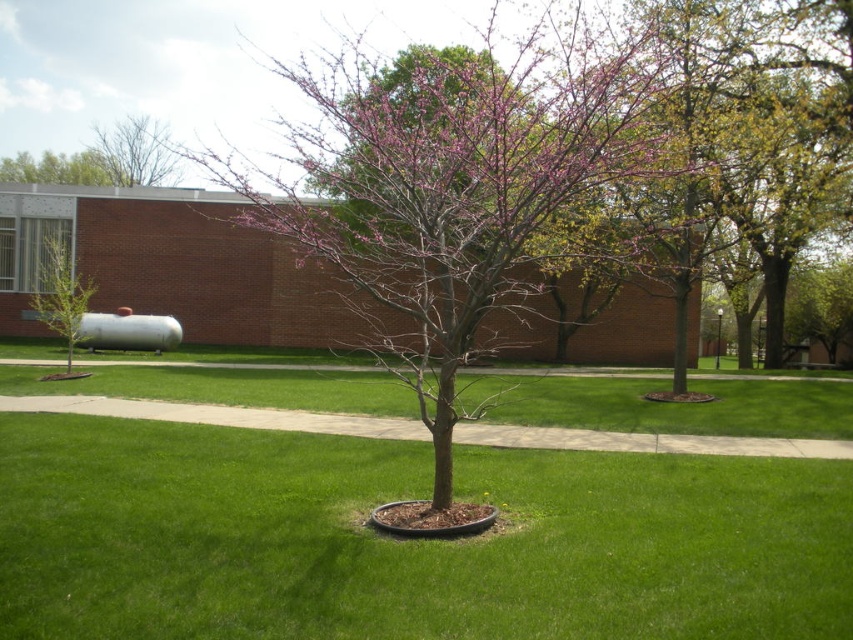
Which is behind, point (421, 381) or point (161, 124)?

The point (161, 124) is behind.

Between point (646, 42) and point (154, 163), which one is positioned behind?

Positioned behind is point (154, 163).

Locate an element on the screen. This screenshot has height=640, width=853. purple-barked tree at center is located at coordinates tap(459, 180).

Which is more to the left, bare branches at upper left or green leafy tree at left?

bare branches at upper left

Which is behind, point (152, 172) or point (45, 269)?

The point (152, 172) is behind.

Is point (109, 176) positioned behind point (45, 269)?

Yes, point (109, 176) is farther from viewer.

What are the coordinates of `bare branches at upper left` in the screenshot? It's located at (134, 152).

Is purple-barked tree at center positioned at the back of green leafy tree at left?

That is False.

Can you confirm if purple-barked tree at center is bigger than green leafy tree at left?

Yes, purple-barked tree at center is bigger than green leafy tree at left.

Is point (476, 186) positioned in front of point (68, 353)?

Yes.

Locate an element on the screen. This screenshot has height=640, width=853. purple-barked tree at center is located at coordinates (459, 180).